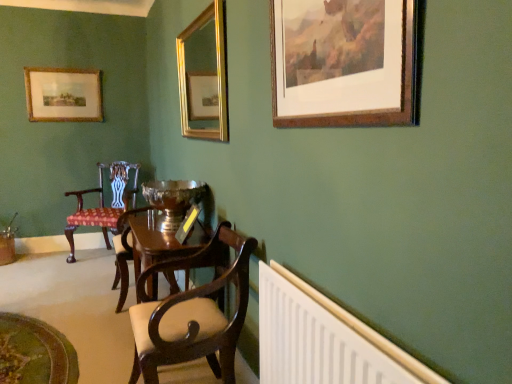
Question: From a real-world perspective, is mahogany wood chair at center, placed as the first chair when sorted from front to back, positioned under wooden picture frame at upper left, the third picture frame positioned from the front, based on gravity?

Choices:
 (A) no
 (B) yes

Answer: (B)

Question: Is mahogany wood chair at center, placed as the first chair when sorted from front to back, wider than wooden picture frame at upper left, the third picture frame positioned from the front?

Choices:
 (A) no
 (B) yes

Answer: (B)

Question: Does mahogany wood chair at center, placed as the 2th chair when sorted from back to front, have a greater height compared to wooden picture frame at upper left, arranged as the third picture frame when viewed from the right?

Choices:
 (A) yes
 (B) no

Answer: (A)

Question: Is mahogany wood chair at center, placed as the first chair when sorted from front to back, surrounding wooden picture frame at upper left, the first picture frame positioned from the back?

Choices:
 (A) no
 (B) yes

Answer: (A)

Question: From the image's perspective, does mahogany wood chair at center, placed as the 2th chair when sorted from back to front, appear lower than wooden picture frame at upper left, the first picture frame positioned from the back?

Choices:
 (A) no
 (B) yes

Answer: (B)

Question: Considering the relative positions of white plastic radiator at lower right and mahogany wood armchair at center in the image provided, is white plastic radiator at lower right to the left or to the right of mahogany wood armchair at center?

Choices:
 (A) left
 (B) right

Answer: (B)

Question: Is white plastic radiator at lower right wider or thinner than mahogany wood armchair at center?

Choices:
 (A) thin
 (B) wide

Answer: (A)

Question: Choose the correct answer: Is white plastic radiator at lower right inside mahogany wood armchair at center or outside it?

Choices:
 (A) inside
 (B) outside

Answer: (B)

Question: Considering the positions of point (278, 296) and point (119, 235), is point (278, 296) closer or farther from the camera than point (119, 235)?

Choices:
 (A) farther
 (B) closer

Answer: (B)

Question: Considering the positions of mahogany wood chair at center, placed as the 2th chair when sorted from back to front, and wooden picture frame at upper left, the first picture frame positioned from the back, in the image, is mahogany wood chair at center, placed as the 2th chair when sorted from back to front, taller or shorter than wooden picture frame at upper left, the first picture frame positioned from the back,?

Choices:
 (A) tall
 (B) short

Answer: (A)

Question: In terms of size, does mahogany wood chair at center, which appears as the 2th chair when viewed from the left, appear bigger or smaller than wooden picture frame at upper left, the 1th picture frame from the left?

Choices:
 (A) big
 (B) small

Answer: (A)

Question: In the image, is mahogany wood chair at center, placed as the first chair when sorted from front to back, on the left side or the right side of wooden picture frame at upper left, the third picture frame positioned from the front?

Choices:
 (A) right
 (B) left

Answer: (A)

Question: Considering the positions of point (222, 369) and point (72, 76), is point (222, 369) closer or farther from the camera than point (72, 76)?

Choices:
 (A) farther
 (B) closer

Answer: (B)

Question: Looking at their shapes, would you say white plastic radiator at lower right is wider or thinner than mahogany wood chair at center, arranged as the 1th chair when viewed from the right?

Choices:
 (A) thin
 (B) wide

Answer: (A)

Question: Is white plastic radiator at lower right bigger or smaller than mahogany wood chair at center, arranged as the 1th chair when viewed from the right?

Choices:
 (A) small
 (B) big

Answer: (A)